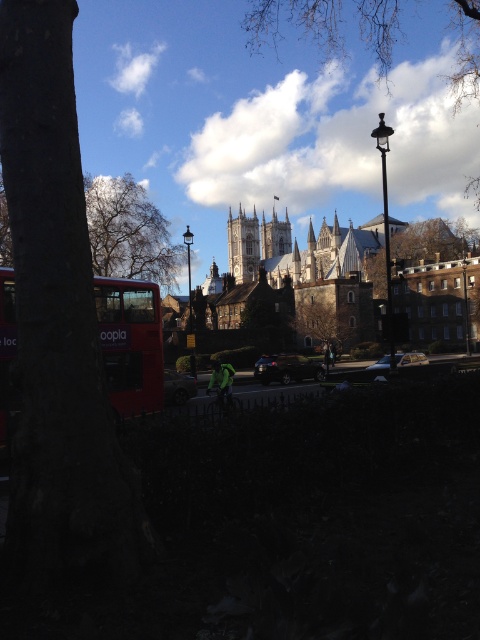
Question: Which object is positioned farthest from the white stone castle at center?

Choices:
 (A) matte red double-decker bus at lower left
 (B) stone gothic tower at center
 (C) green leafy tree at center

Answer: (A)

Question: Considering the relative positions of bare branches at left and stone gothic cathedral at center in the image provided, where is bare branches at left located with respect to stone gothic cathedral at center?

Choices:
 (A) right
 (B) left

Answer: (B)

Question: Which of these objects is positioned closest to the green leafy tree at center?

Choices:
 (A) shiny silver car at center
 (B) stone gothic cathedral at center

Answer: (A)

Question: Which point is closer to the camera?

Choices:
 (A) (164, 381)
 (B) (251, 266)
 (C) (272, 218)

Answer: (A)

Question: Can you confirm if green leafy tree at center is positioned to the left of stone gothic tower at center?

Choices:
 (A) no
 (B) yes

Answer: (B)

Question: Can you confirm if shiny silver car at center is positioned below shiny black car at center?

Choices:
 (A) no
 (B) yes

Answer: (A)